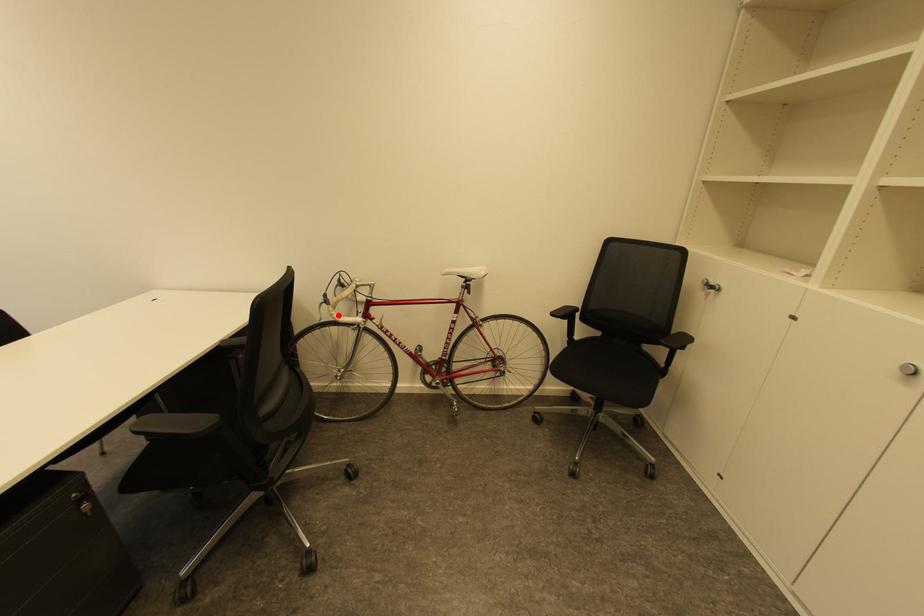
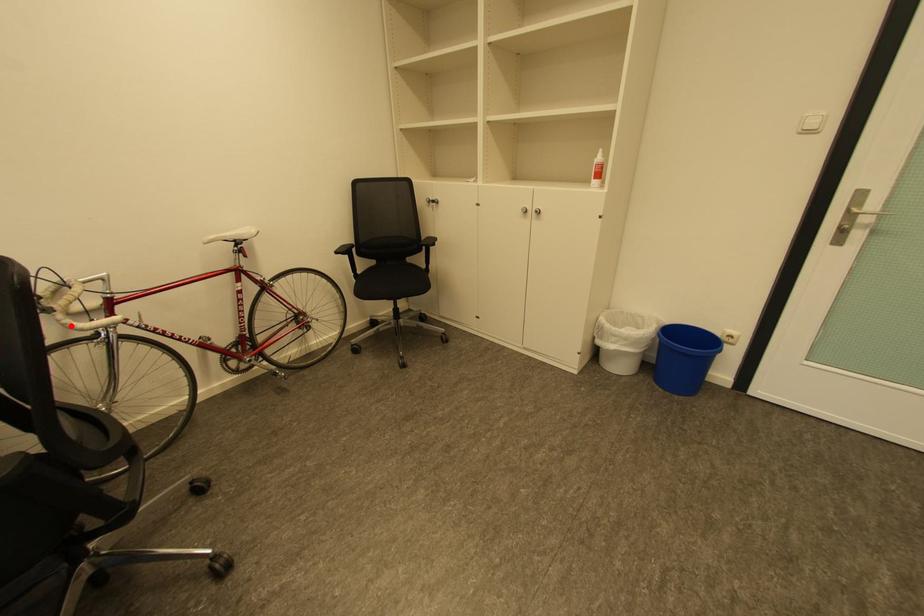
I am providing you with two images of the same scene from different viewpoints. A red point is marked on the first image and another point is marked on the second image. Is the marked point in image1 the same physical position as the marked point in image2?

Yes